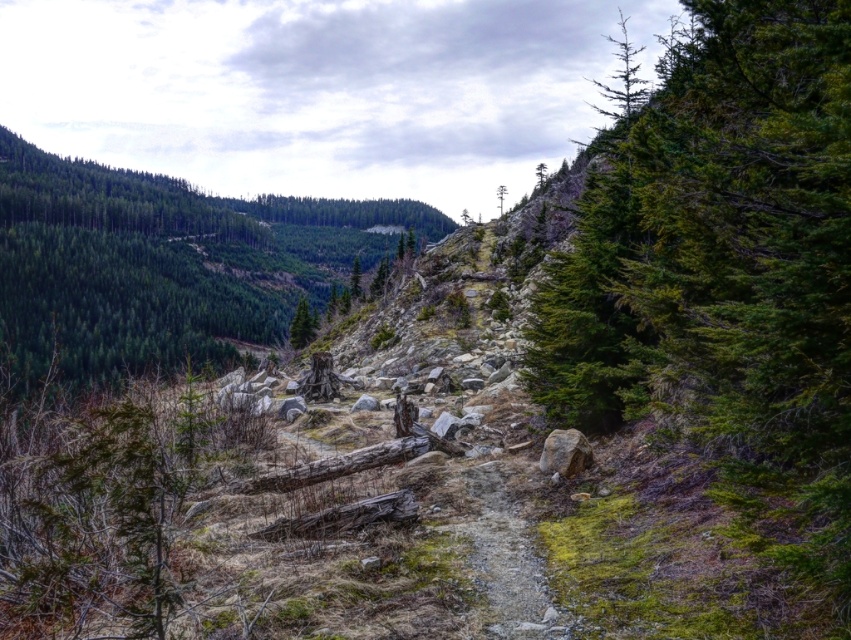
Which is more to the right, green matte tree at upper left or green matte tree at center?

Positioned to the right is green matte tree at center.

Is point (35, 250) farther from camera compared to point (309, 330)?

Yes.

Between point (83, 225) and point (306, 321), which one is positioned behind?

Point (83, 225)

Locate an element on the screen. The image size is (851, 640). green matte tree at upper left is located at coordinates (164, 262).

Who is lower down, green matte tree at upper left or dirt path at center?

dirt path at center

Is point (78, 248) positioned in front of point (507, 564)?

That is False.

Describe the element at coordinates (164, 262) in the screenshot. Image resolution: width=851 pixels, height=640 pixels. I see `green matte tree at upper left` at that location.

Find the location of `green matte tree at upper left`. green matte tree at upper left is located at coordinates (164, 262).

Between green textured tree at right and dirt path at center, which one has less height?

Standing shorter between the two is dirt path at center.

Is point (777, 26) positioned before point (477, 472)?

Yes, it is.

At what (x,y) coordinates should I click in order to perform the action: click on green textured tree at right. Please return your answer as a coordinate pair (x, y). Looking at the image, I should click on (724, 272).